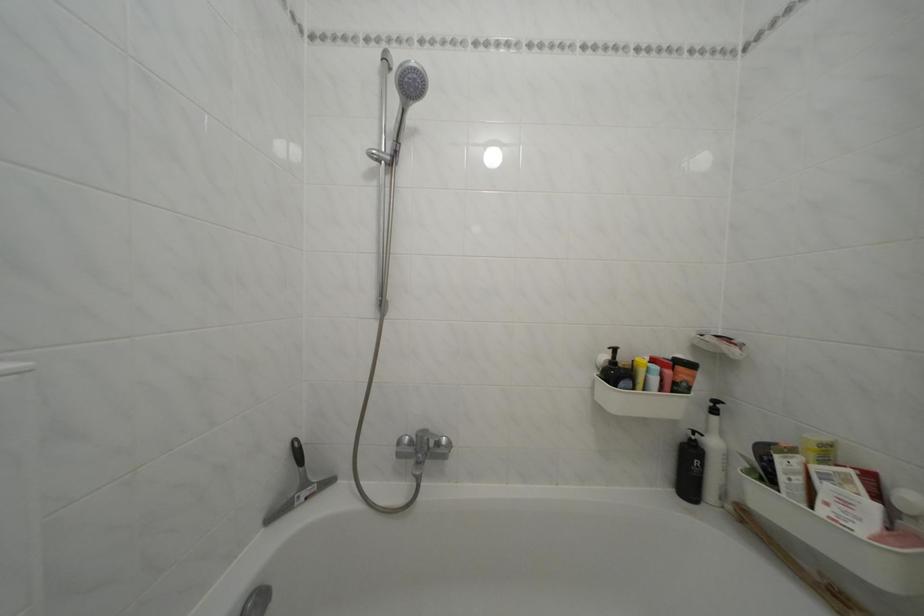
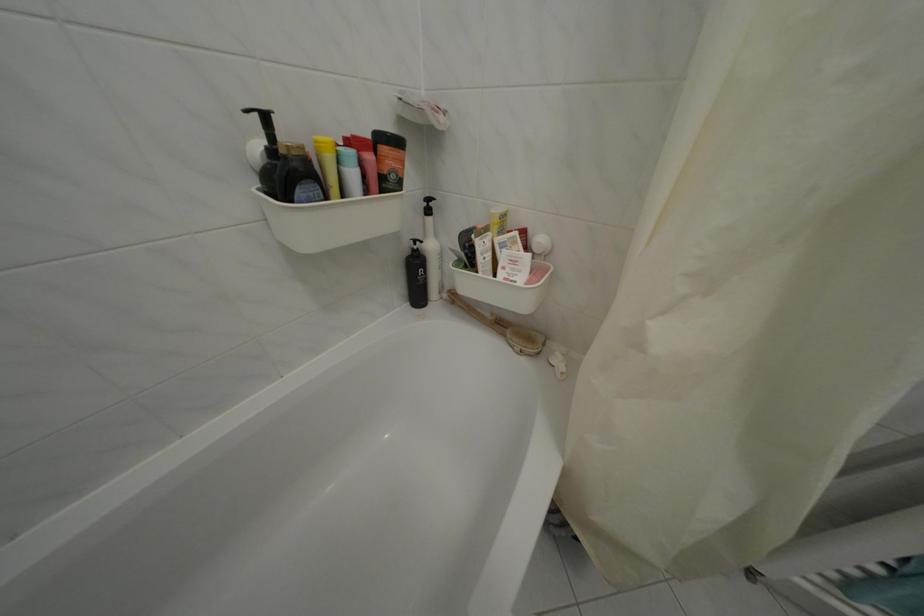
The point at (647,365) is marked in the first image. Where is the corresponding point in the second image?

(325, 144)